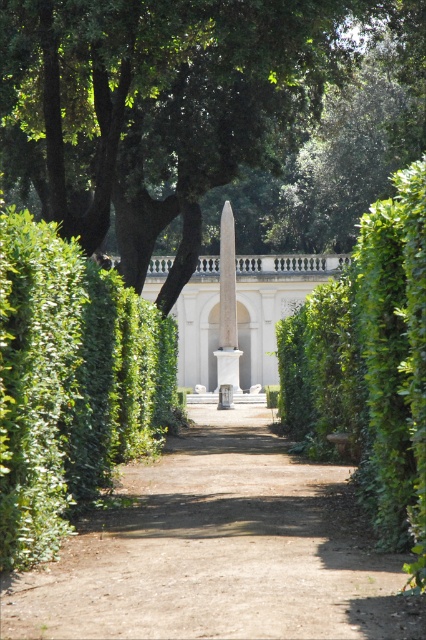
You are a gardener planning to trim the green leafy hedge at left and the green leafy hedge at center. Based on their sizes, which hedge requires more time to trim?

The green leafy hedge at center requires more time to trim because it is larger than the green leafy hedge at left.

You are standing on the garden pathway and want to walk towards the white structure in the background. Which hedge, the green leafy hedge at left or the green leafy hedge at center, is closer to your right side as you face the structure?

The green leafy hedge at center is closer to your right side because as you face the white structure, the green leafy hedge at left is positioned to the left of the green leafy hedge at center, meaning the center hedge is further along the path and thus closer to your right side.

You are a gardener planning to plant a new row of flowers between the green leafy tree at center and the green leafy hedge at left. The flowers require a minimum of 40 feet of space to grow properly. Based on the garden layout, will there be enough space for the flowers to thrive?

The distance between the green leafy tree at center and the green leafy hedge at left is 39.96 feet, which is slightly less than the required 40 feet. Therefore, there is not enough space for the flowers to thrive properly.